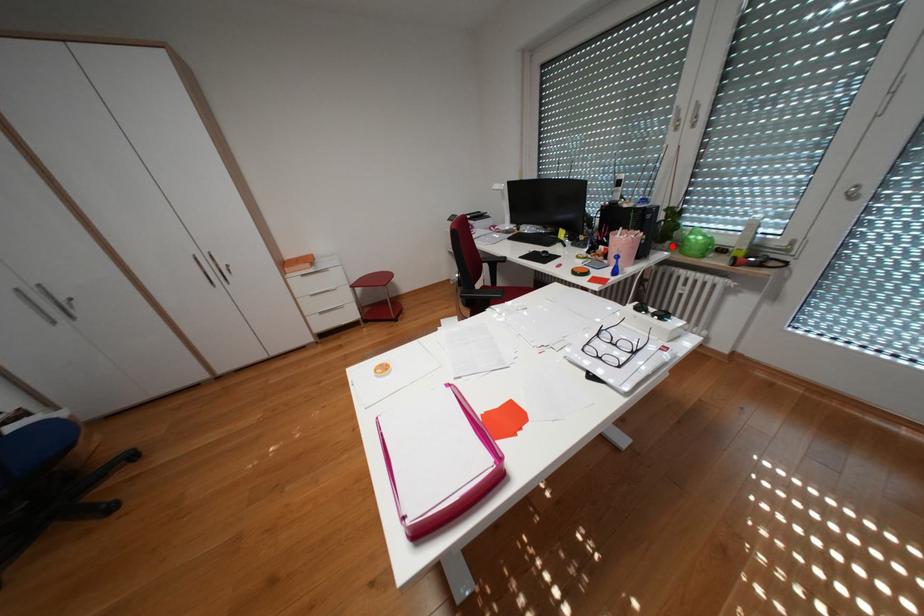
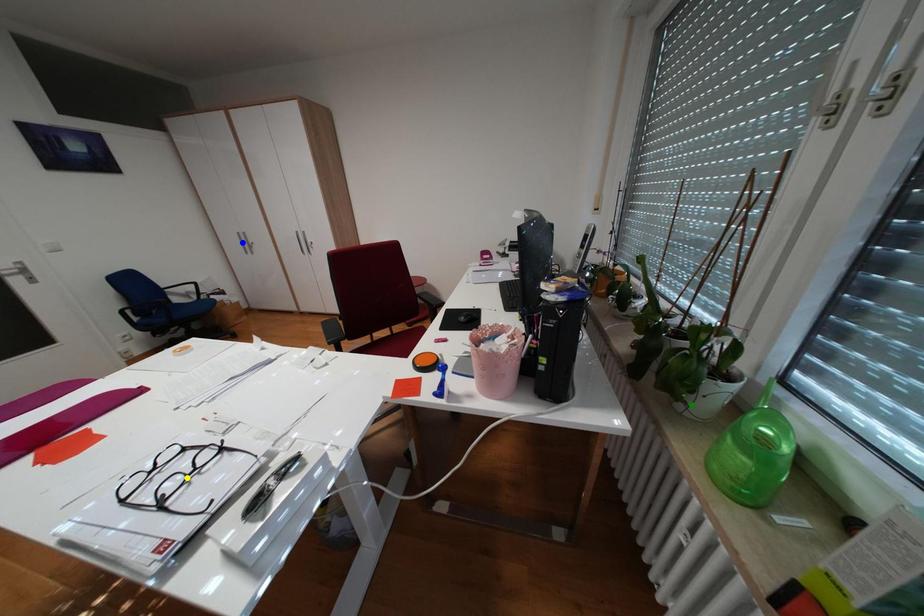
Question: I am providing you with two images of the same scene from different viewpoints. A red point is marked on the first image. You are given multiple points on the second image. Which point in image 2 is actually the same real-world point as the red point in image 1?

Choices:
 (A) yellow point
 (B) blue point
 (C) green point

Answer: (C)